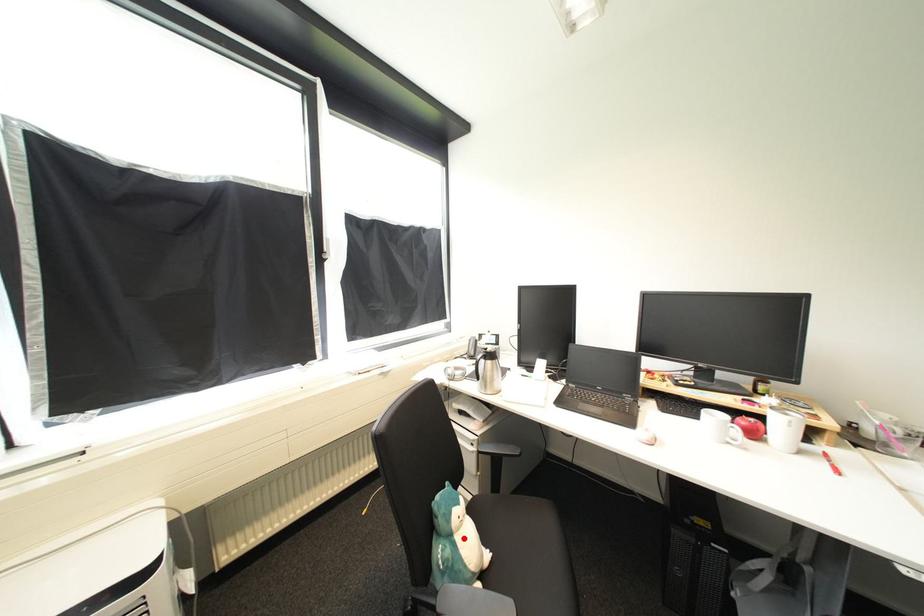
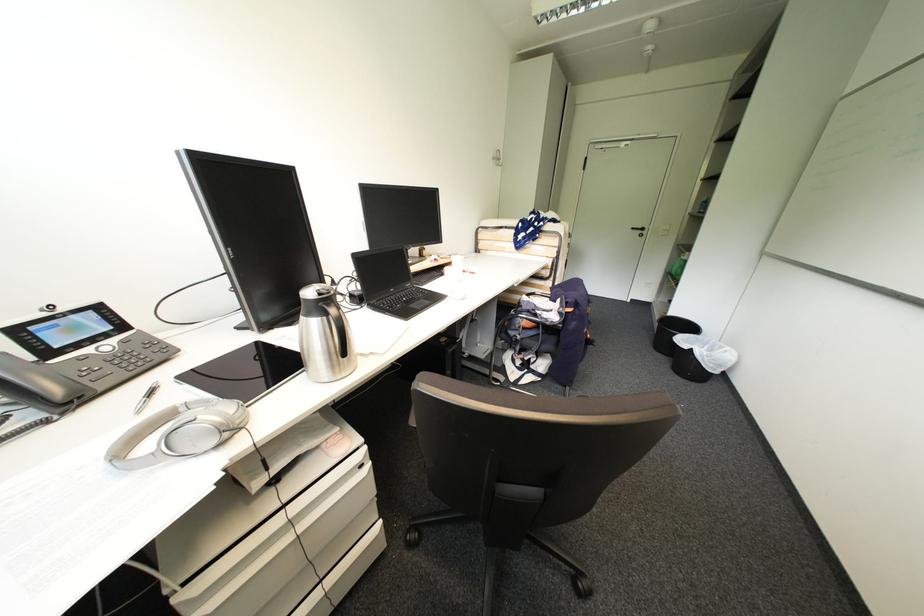
Question: I am providing you with two images of the same scene from different viewpoints. A red point is marked on the first image. Can you still see the location of the red point in image 2?

Choices:
 (A) Yes
 (B) No

Answer: (B)